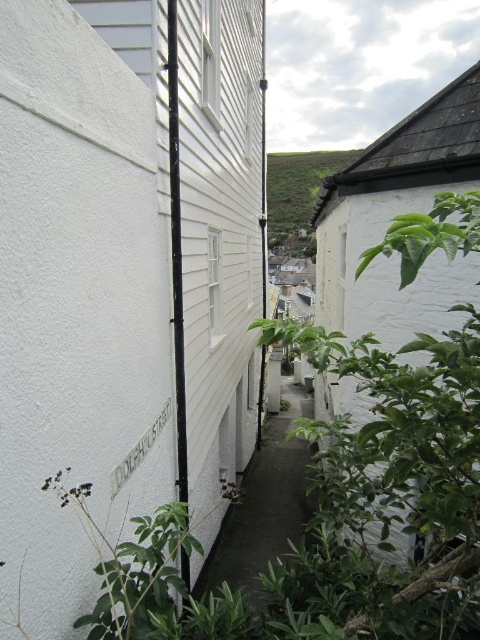
You are standing at the entrance of the dark gray concrete alley at center and looking towards the green leafy plant at upper center. Which object appears taller from your perspective?

The green leafy plant at upper center appears taller than the dark gray concrete alley at center from your perspective because the description states that the dark gray concrete alley at center has a lesser height compared to the green leafy plant at upper center.